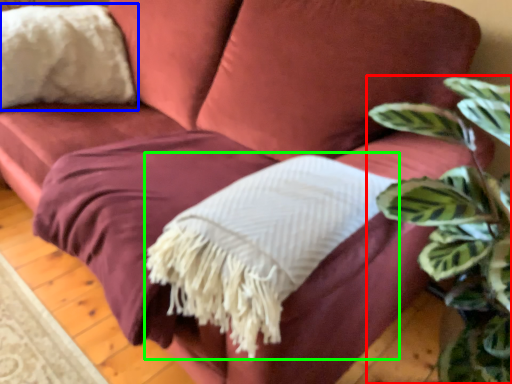
Question: Which object is the closest to the houseplant (highlighted by a red box)? Choose among these: throw pillow (highlighted by a blue box) or blanket (highlighted by a green box).

Choices:
 (A) throw pillow
 (B) blanket

Answer: (B)